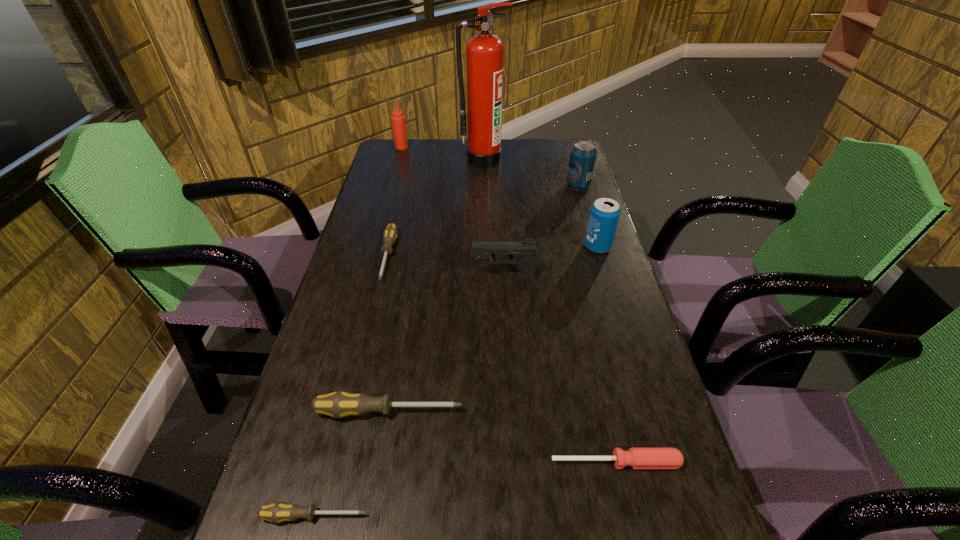
Find the location of `blank area located at the barrel of the pistol`. blank area located at the barrel of the pistol is located at coordinates (352, 276).

At what (x,y) coordinates should I click in order to perform the action: click on vacant space located at the tip of the second nearest gray screwdriver. Please return your answer as a coordinate pair (x, y). The height and width of the screenshot is (540, 960). Looking at the image, I should click on (551, 411).

Where is `free space located 0.320m at the tip of the farthest gray screwdriver`? free space located 0.320m at the tip of the farthest gray screwdriver is located at coordinates (356, 390).

Find the location of a particular element. The image size is (960, 540). vacant space located on the left of the second nearest object is located at coordinates (460, 462).

You are a GUI agent. You are given a task and a screenshot of the screen. Output one action in this format:
    pyautogui.click(x=<x>, y=<y>)
    Task: Click on the free region located 0.050m at the tip of the smallest gray screwdriver
    
    Given the screenshot: What is the action you would take?
    pyautogui.click(x=396, y=516)

In order to click on fire extinguisher situated at the far edge in this screenshot , I will do `click(484, 52)`.

The height and width of the screenshot is (540, 960). Identify the location of Tabasco sauce positioned at the far edge. (398, 119).

Where is `Tabasco sauce that is at the left edge`? This screenshot has height=540, width=960. Tabasco sauce that is at the left edge is located at coordinates (398, 119).

You are a GUI agent. You are given a task and a screenshot of the screen. Output one action in this format:
    pyautogui.click(x=<x>, y=<y>)
    Task: Click on the screwdriver that is positioned at the right edge
    The width and height of the screenshot is (960, 540).
    Given the screenshot: What is the action you would take?
    pyautogui.click(x=638, y=458)

This screenshot has width=960, height=540. I want to click on object that is at the far left corner, so click(x=398, y=119).